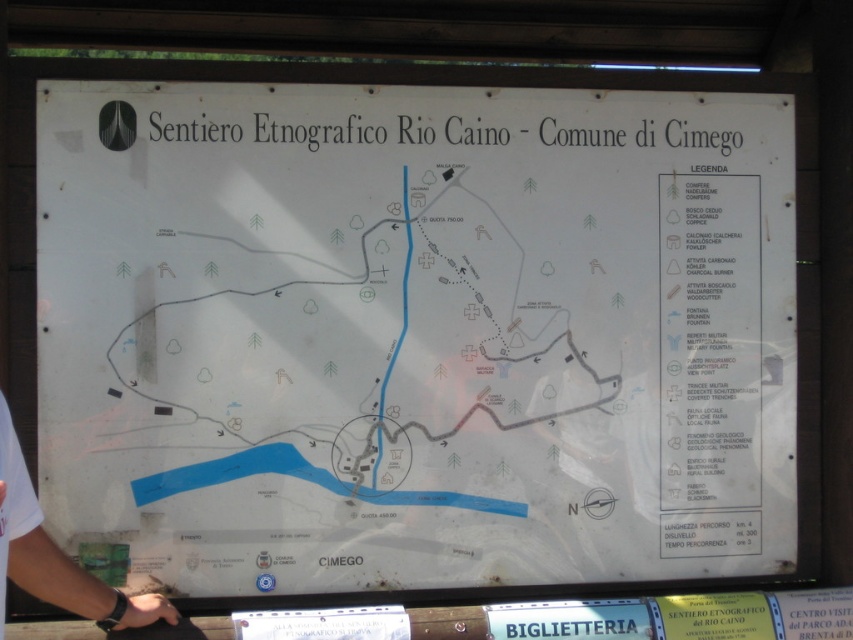
Question: Does white paper map at center lie behind white t-shirt at lower left?

Choices:
 (A) no
 (B) yes

Answer: (B)

Question: Does white paper map at center have a lesser width compared to white t-shirt at lower left?

Choices:
 (A) yes
 (B) no

Answer: (B)

Question: Which point appears closest to the camera in this image?

Choices:
 (A) click(9, 492)
 (B) click(416, 460)

Answer: (A)

Question: In this image, where is white paper map at center located relative to white t-shirt at lower left?

Choices:
 (A) above
 (B) below

Answer: (A)